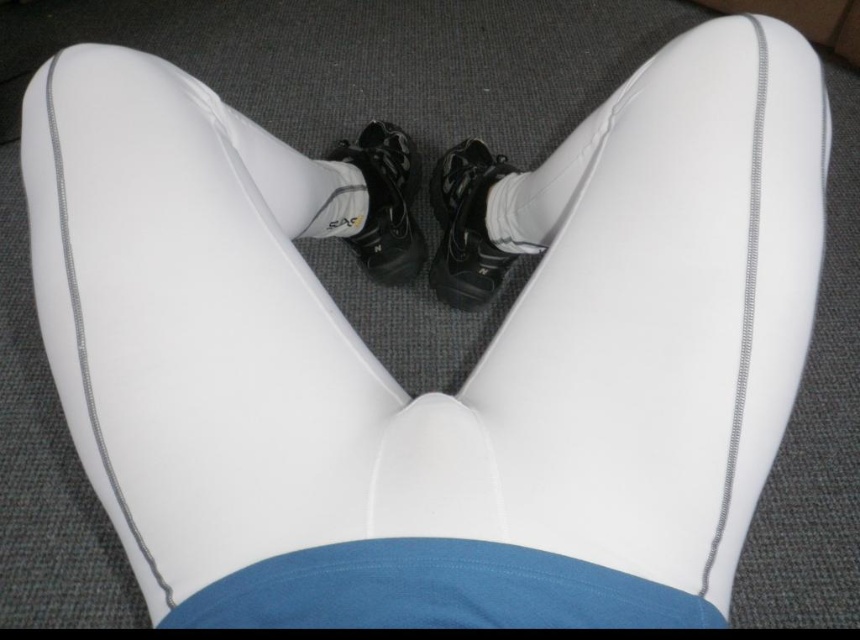
Can you confirm if black matte shoe at center is smaller than shiny black shoe at center?

Indeed, black matte shoe at center has a smaller size compared to shiny black shoe at center.

Is point (440, 220) farther from camera compared to point (404, 264)?

Yes, point (440, 220) is behind point (404, 264).

Is point (433, 204) closer to camera compared to point (416, 224)?

No.

Identify the location of black matte shoe at center. This screenshot has width=860, height=640. (465, 227).

Does point (437, 176) lie behind point (541, 170)?

Yes, point (437, 176) is behind point (541, 170).

The image size is (860, 640). I want to click on black matte shoe at center, so click(x=465, y=227).

The image size is (860, 640). I want to click on shiny black shoe at center, so click(385, 204).

Consider the image. Does shiny black shoe at center have a greater height compared to white fabric sock at center?

Indeed, shiny black shoe at center has a greater height compared to white fabric sock at center.

Identify the location of shiny black shoe at center. The height and width of the screenshot is (640, 860). (385, 204).